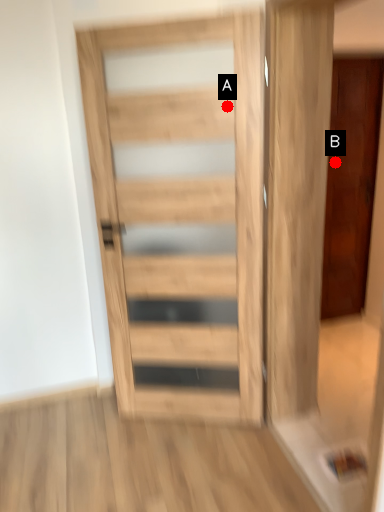
Question: Two points are circled on the image, labeled by A and B beside each circle. Which of the following is the farthest from the observer?

Choices:
 (A) A is further
 (B) B is further

Answer: (B)